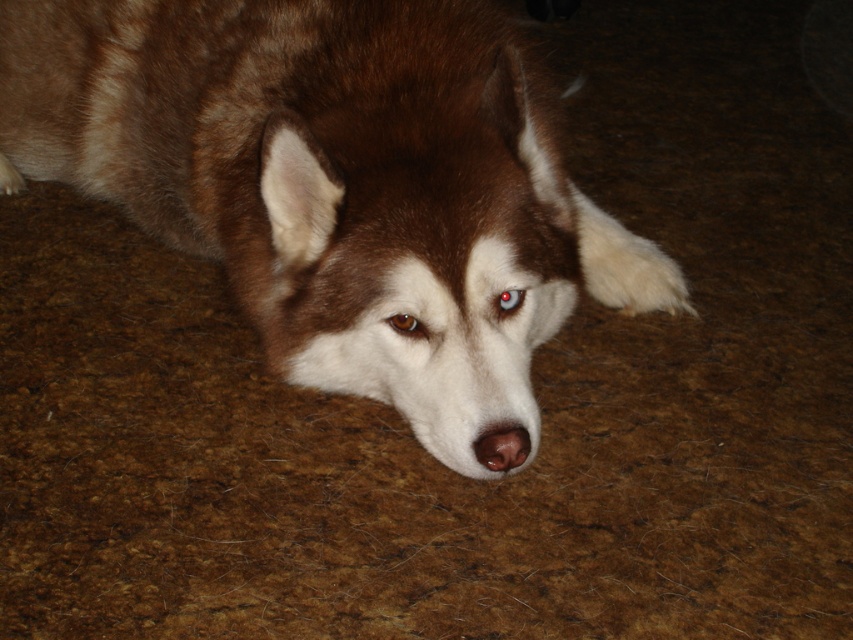
Question: Is brown matte nose at center bigger than brown glossy eye at center?

Choices:
 (A) no
 (B) yes

Answer: (B)

Question: Can you confirm if brown fur dog at center is thinner than shiny brown eye at center?

Choices:
 (A) no
 (B) yes

Answer: (A)

Question: Which object appears closest to the camera in this image?

Choices:
 (A) brown glossy eye at center
 (B) brown fur dog at center
 (C) brown matte nose at center

Answer: (B)

Question: Which object appears closest to the camera in this image?

Choices:
 (A) brown matte nose at center
 (B) brown glossy eye at center
 (C) brown fur dog at center

Answer: (C)

Question: Which point is closer to the camera?

Choices:
 (A) (514, 308)
 (B) (447, 448)

Answer: (B)

Question: Does brown fur dog at center appear on the right side of brown glossy eye at center?

Choices:
 (A) yes
 (B) no

Answer: (B)